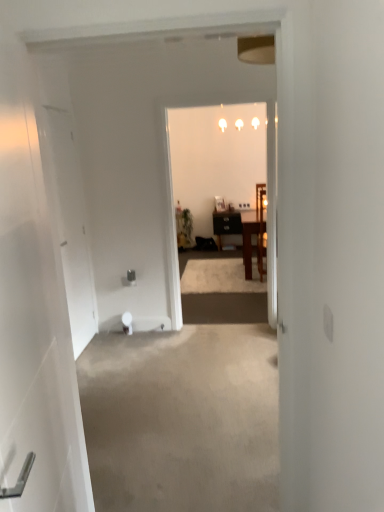
Where is `vacant area that is situated to the right of white matte door at left, the second door in the right-to-left sequence`? This screenshot has height=512, width=384. vacant area that is situated to the right of white matte door at left, the second door in the right-to-left sequence is located at coordinates (129, 340).